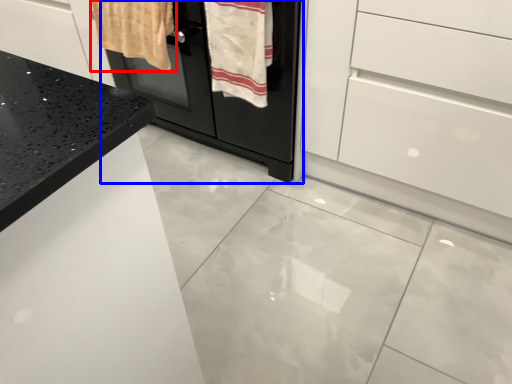
Question: Which point is closer to the camera, bath towel (highlighted by a red box) or oven (highlighted by a blue box)?

Choices:
 (A) bath towel
 (B) oven

Answer: (B)